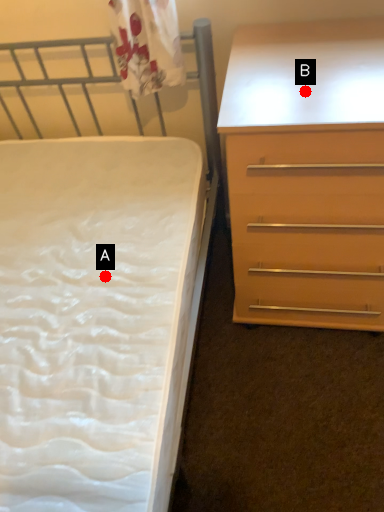
Question: Two points are circled on the image, labeled by A and B beside each circle. Which point appears farthest from the camera in this image?

Choices:
 (A) A is further
 (B) B is further

Answer: (A)